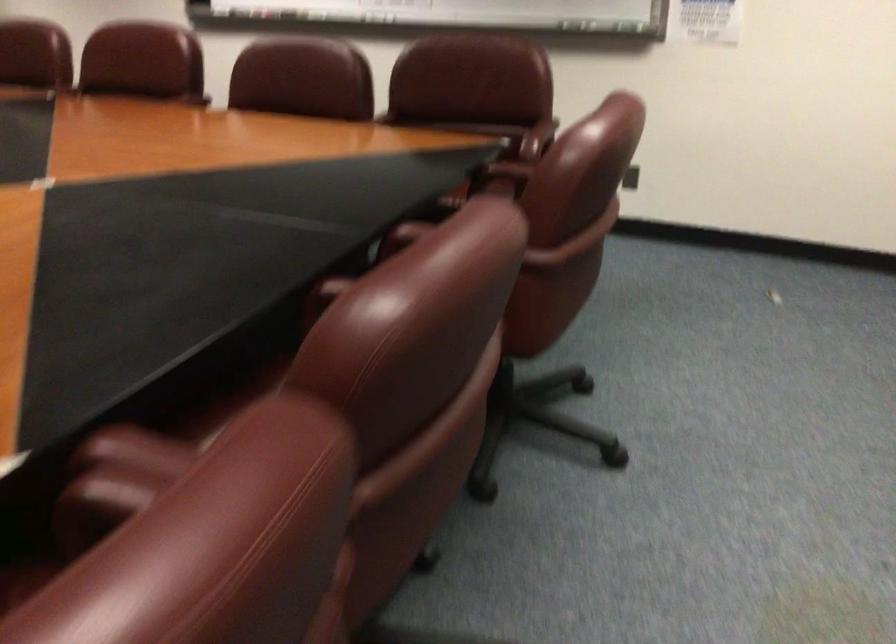
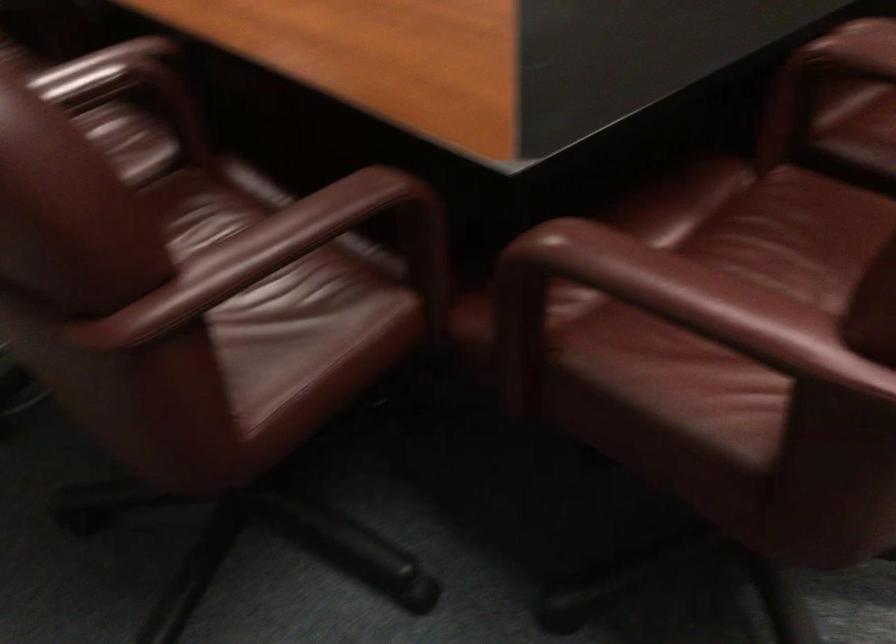
Question: The images are taken continuously from a first-person perspective. In which direction are you moving?

Choices:
 (A) Left
 (B) Right
 (C) Forward
 (D) Backward

Answer: (D)